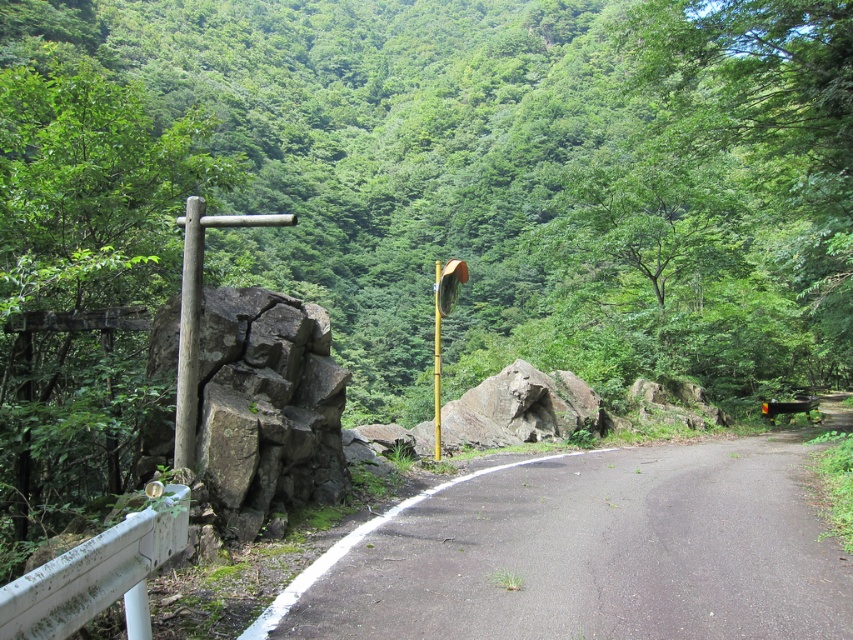
You are driving a car that is 5 meters long. You need to park between the smooth wooden post at left and the gold metallic street sign at center. Is there enough space for your car?

The smooth wooden post at left and gold metallic street sign at center are 7.33 meters apart. Since the car is 5 meters long, there is enough space to park between them.

You are driving a car that is 2 meters wide. You are approaching the black asphalt road at center. Can you safely drive straight ahead without hitting the guardrail on the left or the yellow pole on the right?

The black asphalt road at center is 4.60 meters wide, which is wider than the car width of 2 meters. Therefore, you can safely drive straight ahead without hitting the guardrail on the left or the yellow pole on the right.